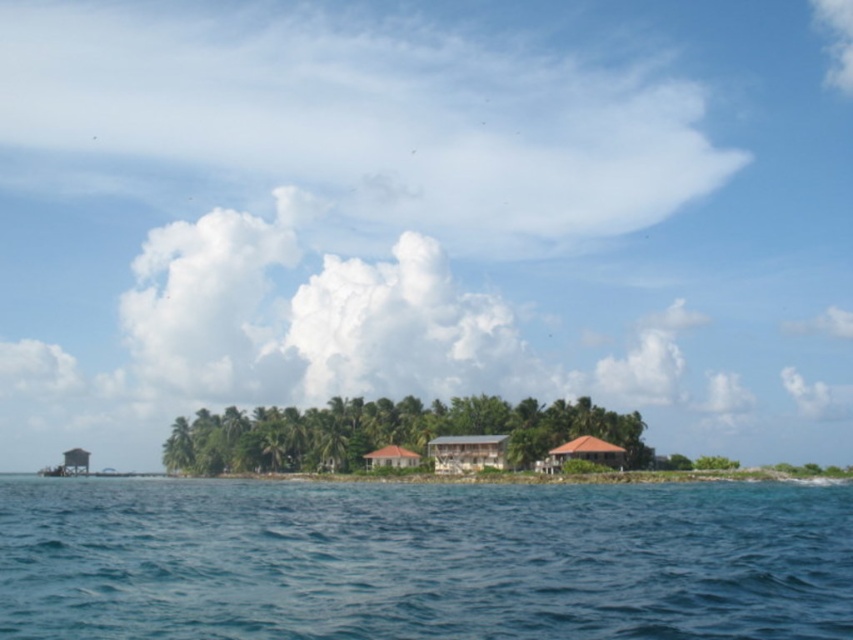
Who is positioned more to the right, brown wooden hut at center or wooden hut at lower left?

Positioned to the right is brown wooden hut at center.

Who is higher up, brown wooden hut at center or wooden hut at lower left?

Positioned higher is brown wooden hut at center.

Is point (459, 470) closer to viewer compared to point (79, 449)?

Yes, point (459, 470) is in front of point (79, 449).

Where is `brown wooden hut at center`? Image resolution: width=853 pixels, height=640 pixels. brown wooden hut at center is located at coordinates (467, 452).

Is brown wooden hut at center taller than brown thatched roof hut at center?

Yes.

Who is lower down, brown wooden hut at center or brown thatched roof hut at center?

Positioned lower is brown wooden hut at center.

Measure the distance between point (473, 438) and camera.

They are 115.49 meters apart.

Find the location of a particular element. This screenshot has height=640, width=853. brown wooden hut at center is located at coordinates (467, 452).

Which is behind, point (556, 548) or point (465, 460)?

The point (465, 460) is behind.

At what (x,y) coordinates should I click in order to perform the action: click on blue water at lower center. Please return your answer as a coordinate pair (x, y). The width and height of the screenshot is (853, 640). Looking at the image, I should click on (422, 560).